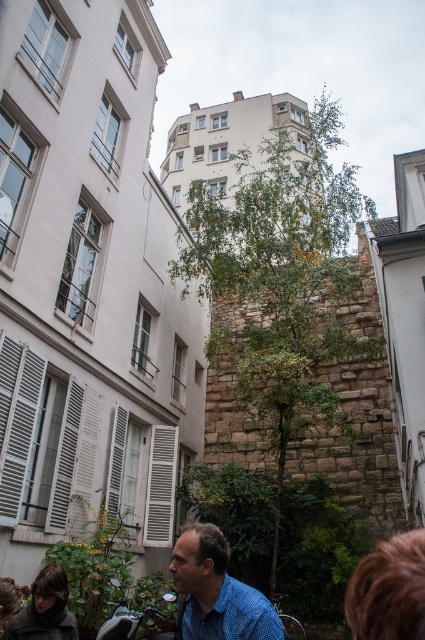
You are a photographer standing in the alleyway and want to capture both the blue checkered shirt at lower center and the shiny chrome motorcycle at lower left in the same frame. Based on their sizes in the image, which object should you focus on first to ensure both are in focus?

The blue checkered shirt at lower center is taller than the shiny chrome motorcycle at lower left, so focusing on the blue checkered shirt at lower center first would ensure both are in focus since it is larger and closer to the camera.

You are a delivery person trying to navigate through the alleyway. The alleyway is only wide enough to allow passage for vehicles up to the width of the shiny chrome motorcycle at lower left. There is a green leafy tree at center blocking the path. Can you pass through the alleyway without hitting the tree?

The green leafy tree at center might be wider than the shiny chrome motorcycle at lower left, so there is a possibility that the tree is wider than the allowed passage width. Therefore, there is a risk of collision if you attempt to pass through.

You are a pedestrian walking along the alleyway and want to take a photo of the blue checkered shirt at lower center without including the green leafy tree at center in the frame. Which direction should you move to achieve this?

You should move to the left of the blue checkered shirt at lower center because the green leafy tree at center is located to its right, so moving left would position the tree out of the frame while keeping the shirt visible.